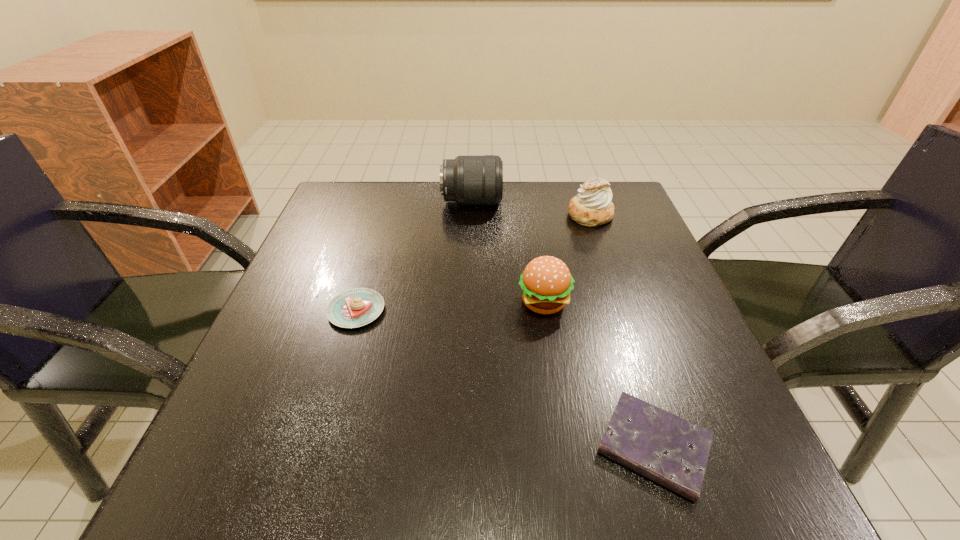
This screenshot has height=540, width=960. Identify the location of free space located 0.050m on the right of the taller pastry. (635, 215).

Locate an element on the screen. This screenshot has width=960, height=540. free point located 0.400m on the back of the hamburger is located at coordinates (x=525, y=182).

The image size is (960, 540). I want to click on free region located on the back of the leftmost object, so 393,186.

This screenshot has height=540, width=960. Find the location of `vacant area located 0.190m on the left of the diary`. vacant area located 0.190m on the left of the diary is located at coordinates (457, 447).

Identify the location of telephoto lens at the far edge. (468, 180).

Image resolution: width=960 pixels, height=540 pixels. In order to click on pastry present at the far edge in this screenshot , I will do `click(592, 207)`.

Identify the location of object situated at the near edge. This screenshot has height=540, width=960. (667, 449).

You are a GUI agent. You are given a task and a screenshot of the screen. Output one action in this format:
    pyautogui.click(x=<x>, y=<y>)
    Task: Click on the object that is positioned at the left edge
    Image resolution: width=960 pixels, height=540 pixels.
    Given the screenshot: What is the action you would take?
    pyautogui.click(x=356, y=307)

Image resolution: width=960 pixels, height=540 pixels. I want to click on pastry that is at the right edge, so click(592, 207).

Where is `diary located at the right edge`? The image size is (960, 540). diary located at the right edge is located at coordinates (x=667, y=449).